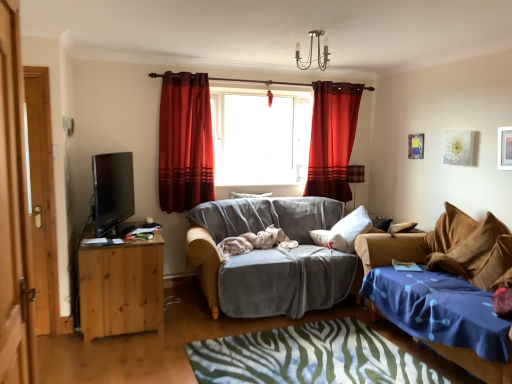
Question: Relative to satin red curtain at center, the 1th curtain in the right-to-left sequence, is velvet blue studio couch at lower right, the first studio couch positioned from the right, in front or behind?

Choices:
 (A) behind
 (B) front

Answer: (B)

Question: Is velvet blue studio couch at lower right, the first studio couch positioned from the right, bigger or smaller than satin red curtain at center, which is the second curtain from left to right?

Choices:
 (A) big
 (B) small

Answer: (A)

Question: Which object is the farthest from the wooden door at left, arranged as the second door when viewed from the left?

Choices:
 (A) white soft pillow at center, which is counted as the 2th pillow, starting from the front
 (B) metallic chandelier at upper center, which ranks as the 1th lamp in front-to-back order
 (C) velvet blue studio couch at lower right, acting as the 2th studio couch starting from the left
 (D) satin red curtain at center, the 2th curtain viewed from the front
 (E) plaid fabric lampshade at right, which is the 2th lamp in top-to-bottom order

Answer: (E)

Question: Estimate the real-world distances between objects in this image. Which object is farther from the pine wood desk at left?

Choices:
 (A) blue fabric bedcover at lower center
 (B) velvet deep red curtain at center, positioned as the second curtain in back-to-front order
 (C) metallic chandelier at upper center, which ranks as the 1th lamp in front-to-back order
 (D) white soft pillow at center, marked as the 2th pillow in a back-to-front arrangement
 (E) matte black tv at left

Answer: (C)